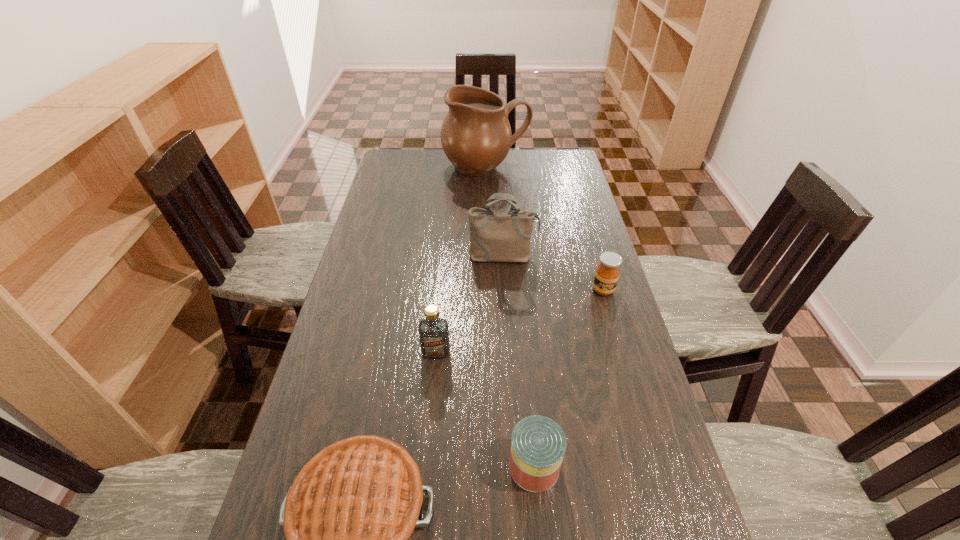
This screenshot has width=960, height=540. Find the location of `empty location between the shoulder bag and the vodka`. empty location between the shoulder bag and the vodka is located at coordinates 469,305.

Locate an element on the screen. vacant space that is in between the second tallest object and the can is located at coordinates (518, 362).

Locate an element on the screen. The image size is (960, 540). free spot between the fifth shortest object and the honey is located at coordinates (553, 273).

Image resolution: width=960 pixels, height=540 pixels. What are the coordinates of `free space between the can and the rightmost object` in the screenshot? It's located at (568, 379).

The width and height of the screenshot is (960, 540). Identify the location of free area in between the rightmost object and the shoulder bag. (553, 273).

Locate an element on the screen. The width and height of the screenshot is (960, 540). empty space between the cream pitcher and the can is located at coordinates (510, 317).

Where is `object that can be found as the third closest to the can`? object that can be found as the third closest to the can is located at coordinates (607, 273).

Identify which object is the second closest to the pie. Please provide its 2D coordinates. Your answer should be formatted as a tuple, i.e. [(x, y)], where the tuple contains the x and y coordinates of a point satisfying the conditions above.

[(433, 331)]

At what (x,y) coordinates should I click in order to perform the action: click on vacant space that satisfies the following two spatial constraints: 1. on the front-facing side of the second farthest object; 2. on the right side of the can. Please return your answer as a coordinate pair (x, y). The height and width of the screenshot is (540, 960). Looking at the image, I should click on (516, 467).